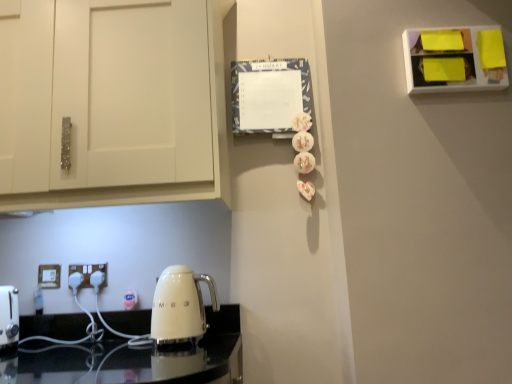
Question: Is white plastic electric outlet at lower left, the 2th electric outlet viewed from the right, oriented towards white plastic electric outlet at lower left, placed as the 1th electric outlet when sorted from right to left?

Choices:
 (A) yes
 (B) no

Answer: (B)

Question: From the image's perspective, does white plastic electric outlet at lower left, the 2th electric outlet viewed from the right, appear higher than white plastic electric outlet at lower left, the 2th electric outlet in the left-to-right sequence?

Choices:
 (A) yes
 (B) no

Answer: (B)

Question: Does white plastic electric outlet at lower left, the 2th electric outlet viewed from the right, touch white plastic electric outlet at lower left, the 2th electric outlet in the left-to-right sequence?

Choices:
 (A) yes
 (B) no

Answer: (B)

Question: Does white plastic electric outlet at lower left, marked as the first electric outlet in a left-to-right arrangement, have a lesser height compared to white plastic electric outlet at lower left, the 2th electric outlet in the left-to-right sequence?

Choices:
 (A) yes
 (B) no

Answer: (B)

Question: Does white plastic electric outlet at lower left, the 2th electric outlet viewed from the right, have a greater width compared to white plastic electric outlet at lower left, the 2th electric outlet in the left-to-right sequence?

Choices:
 (A) no
 (B) yes

Answer: (A)

Question: From the image's perspective, is white plastic electric outlet at lower left, the 2th electric outlet viewed from the right, beneath white plastic electric outlet at lower left, the 2th electric outlet in the left-to-right sequence?

Choices:
 (A) no
 (B) yes

Answer: (B)

Question: Considering the relative sizes of white plastic electric outlet at lower left, the 2th electric outlet in the left-to-right sequence, and white plastic electric outlet at lower left, the 2th electric outlet viewed from the right, in the image provided, is white plastic electric outlet at lower left, the 2th electric outlet in the left-to-right sequence, shorter than white plastic electric outlet at lower left, the 2th electric outlet viewed from the right,?

Choices:
 (A) yes
 (B) no

Answer: (A)

Question: Is the surface of white plastic electric outlet at lower left, the 2th electric outlet in the left-to-right sequence, in direct contact with white plastic electric outlet at lower left, the 2th electric outlet viewed from the right?

Choices:
 (A) no
 (B) yes

Answer: (A)

Question: From a real-world perspective, does white plastic electric outlet at lower left, placed as the 1th electric outlet when sorted from right to left, sit lower than white plastic electric outlet at lower left, marked as the first electric outlet in a left-to-right arrangement?

Choices:
 (A) no
 (B) yes

Answer: (A)

Question: Is white plastic electric outlet at lower left, the 2th electric outlet in the left-to-right sequence, looking in the opposite direction of white plastic electric outlet at lower left, the 2th electric outlet viewed from the right?

Choices:
 (A) no
 (B) yes

Answer: (A)

Question: Is white plastic electric outlet at lower left, the 2th electric outlet in the left-to-right sequence, far from white plastic electric outlet at lower left, the 2th electric outlet viewed from the right?

Choices:
 (A) no
 (B) yes

Answer: (A)

Question: Is white plastic electric outlet at lower left, the 2th electric outlet in the left-to-right sequence, oriented towards white plastic electric outlet at lower left, the 2th electric outlet viewed from the right?

Choices:
 (A) yes
 (B) no

Answer: (B)

Question: Is white plastic electric outlet at lower left, the 2th electric outlet viewed from the right, bigger or smaller than white plastic electric outlet at lower left, the 2th electric outlet in the left-to-right sequence?

Choices:
 (A) small
 (B) big

Answer: (A)